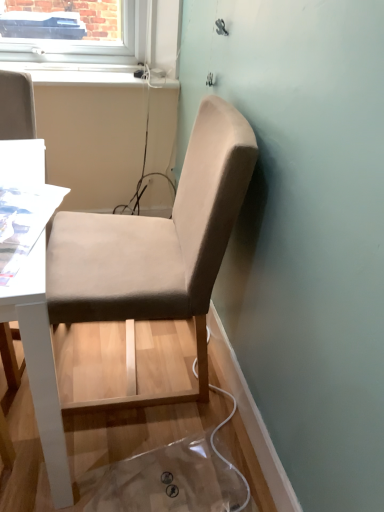
Question: Do you think beige fabric chair at center is within white plastic window sill at upper center, or outside of it?

Choices:
 (A) inside
 (B) outside

Answer: (B)

Question: Considering the positions of beige fabric chair at center and white plastic window sill at upper center in the image, is beige fabric chair at center taller or shorter than white plastic window sill at upper center?

Choices:
 (A) tall
 (B) short

Answer: (A)

Question: In the image, is beige fabric chair at center positioned in front of or behind white plastic window sill at upper center?

Choices:
 (A) behind
 (B) front

Answer: (B)

Question: From a real-world perspective, relative to beige fabric chair at center, is white plastic window sill at upper center vertically above or below?

Choices:
 (A) above
 (B) below

Answer: (A)

Question: From the image's perspective, is white plastic window sill at upper center above or below beige fabric chair at center?

Choices:
 (A) below
 (B) above

Answer: (B)

Question: Relative to beige fabric chair at center, is white plastic window sill at upper center in front or behind?

Choices:
 (A) front
 (B) behind

Answer: (B)

Question: Is white plastic window sill at upper center to the left or to the right of beige fabric chair at center in the image?

Choices:
 (A) right
 (B) left

Answer: (B)